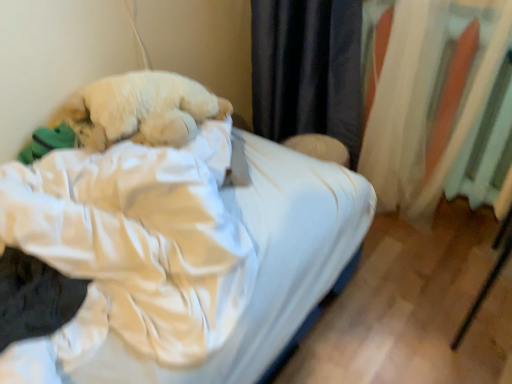
Question: Based on their positions, is fluffy white dog at center located to the left or right of white fabric curtain at right?

Choices:
 (A) left
 (B) right

Answer: (A)

Question: From a real-world perspective, is fluffy white dog at center above or below white fabric curtain at right?

Choices:
 (A) below
 (B) above

Answer: (B)

Question: Which is nearer to the white satin bed at center?

Choices:
 (A) white fabric curtain at right
 (B) fluffy white dog at center

Answer: (B)

Question: Which is nearer to the white satin bed at center?

Choices:
 (A) fluffy white dog at center
 (B) white fabric curtain at right

Answer: (A)